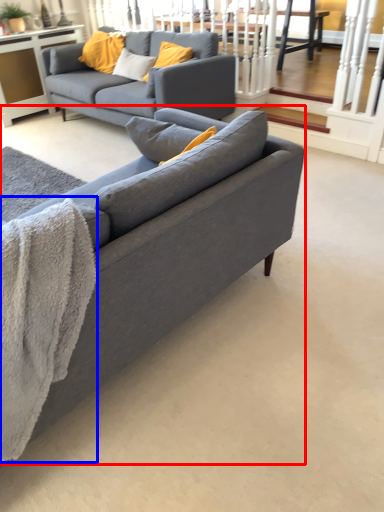
Question: Which object appears farthest to the camera in this image, studio couch (highlighted by a red box) or blanket (highlighted by a blue box)?

Choices:
 (A) studio couch
 (B) blanket

Answer: (B)